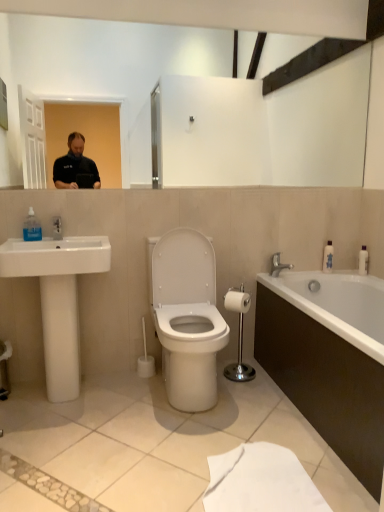
Question: Can you confirm if silver metallic faucet at right is smaller than white plastic toilet brush at center?

Choices:
 (A) yes
 (B) no

Answer: (A)

Question: Does silver metallic faucet at right appear on the right side of white plastic toilet brush at center?

Choices:
 (A) yes
 (B) no

Answer: (A)

Question: Is silver metallic faucet at right oriented away from white plastic toilet brush at center?

Choices:
 (A) no
 (B) yes

Answer: (A)

Question: Is silver metallic faucet at right positioned beyond the bounds of white plastic toilet brush at center?

Choices:
 (A) yes
 (B) no

Answer: (A)

Question: Can you confirm if silver metallic faucet at right is bigger than white plastic toilet brush at center?

Choices:
 (A) yes
 (B) no

Answer: (B)

Question: Is transparent plastic soap dispenser at left situated inside white plastic toilet brush at center or outside?

Choices:
 (A) outside
 (B) inside

Answer: (A)

Question: Considering the relative positions of transparent plastic soap dispenser at left and white plastic toilet brush at center in the image provided, is transparent plastic soap dispenser at left to the left or to the right of white plastic toilet brush at center?

Choices:
 (A) right
 (B) left

Answer: (B)

Question: Looking at their shapes, would you say transparent plastic soap dispenser at left is wider or thinner than white plastic toilet brush at center?

Choices:
 (A) thin
 (B) wide

Answer: (A)

Question: Based on their sizes in the image, would you say transparent plastic soap dispenser at left is bigger or smaller than white plastic toilet brush at center?

Choices:
 (A) big
 (B) small

Answer: (B)

Question: Is white plastic bottle at right, arranged as the 1th toiletry when viewed from the right, in front of or behind silver metallic faucet at right in the image?

Choices:
 (A) behind
 (B) front

Answer: (A)

Question: Considering the positions of white plastic bottle at right, arranged as the 1th toiletry when viewed from the right, and silver metallic faucet at right in the image, is white plastic bottle at right, arranged as the 1th toiletry when viewed from the right, taller or shorter than silver metallic faucet at right?

Choices:
 (A) tall
 (B) short

Answer: (A)

Question: Considering the positions of white plastic bottle at right, the 2th toiletry in the left-to-right sequence, and silver metallic faucet at right in the image, is white plastic bottle at right, the 2th toiletry in the left-to-right sequence, bigger or smaller than silver metallic faucet at right?

Choices:
 (A) small
 (B) big

Answer: (A)

Question: From the image's perspective, is white plastic bottle at right, arranged as the 1th toiletry when viewed from the right, located above or below silver metallic faucet at right?

Choices:
 (A) below
 (B) above

Answer: (B)

Question: Is silver metallic faucet at right taller or shorter than white plastic bottle at right, the 2th toiletry in the left-to-right sequence?

Choices:
 (A) short
 (B) tall

Answer: (A)

Question: In the image, is silver metallic faucet at right positioned in front of or behind white plastic bottle at right, arranged as the 1th toiletry when viewed from the right?

Choices:
 (A) front
 (B) behind

Answer: (A)